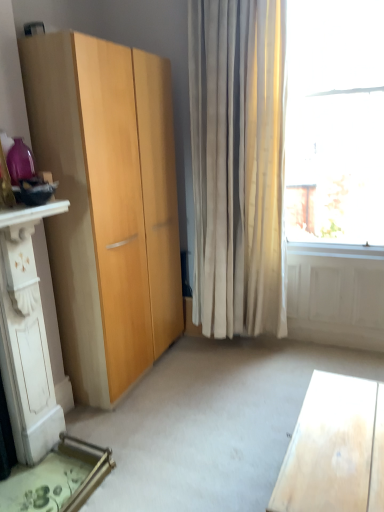
Question: Does light wood desk at lower right have a lesser width compared to white carved wood dresser at lower left?

Choices:
 (A) yes
 (B) no

Answer: (A)

Question: Does light wood desk at lower right have a smaller size compared to white carved wood dresser at lower left?

Choices:
 (A) no
 (B) yes

Answer: (B)

Question: Is light wood desk at lower right oriented towards white carved wood dresser at lower left?

Choices:
 (A) yes
 (B) no

Answer: (A)

Question: Can you confirm if light wood desk at lower right is positioned to the left of white carved wood dresser at lower left?

Choices:
 (A) no
 (B) yes

Answer: (A)

Question: From the image's perspective, is light wood desk at lower right beneath white carved wood dresser at lower left?

Choices:
 (A) no
 (B) yes

Answer: (B)

Question: From the image's perspective, does light wood desk at lower right appear higher than white carved wood dresser at lower left?

Choices:
 (A) yes
 (B) no

Answer: (B)

Question: Can you confirm if white carved wood dresser at lower left is positioned to the left of light wood desk at lower right?

Choices:
 (A) yes
 (B) no

Answer: (A)

Question: From the image's perspective, is white carved wood dresser at lower left located beneath light wood desk at lower right?

Choices:
 (A) no
 (B) yes

Answer: (A)

Question: Can you confirm if white carved wood dresser at lower left is bigger than light wood desk at lower right?

Choices:
 (A) yes
 (B) no

Answer: (A)

Question: Does white carved wood dresser at lower left have a smaller size compared to light wood desk at lower right?

Choices:
 (A) yes
 (B) no

Answer: (B)

Question: From a real-world perspective, does white carved wood dresser at lower left stand above light wood desk at lower right?

Choices:
 (A) no
 (B) yes

Answer: (B)

Question: From the image's perspective, does white carved wood dresser at lower left appear higher than light wood desk at lower right?

Choices:
 (A) yes
 (B) no

Answer: (A)

Question: Is point (344, 506) positioned closer to the camera than point (48, 368)?

Choices:
 (A) closer
 (B) farther

Answer: (A)